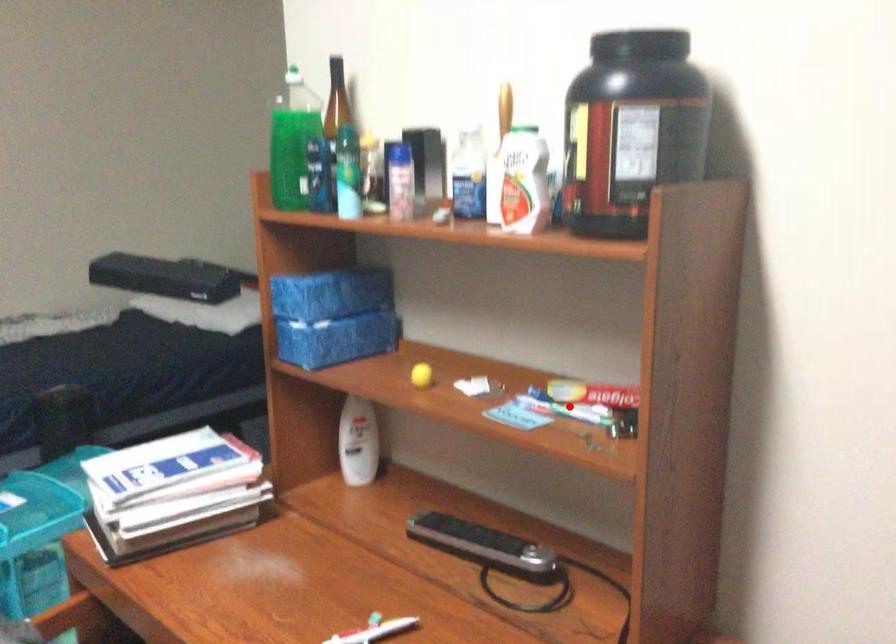
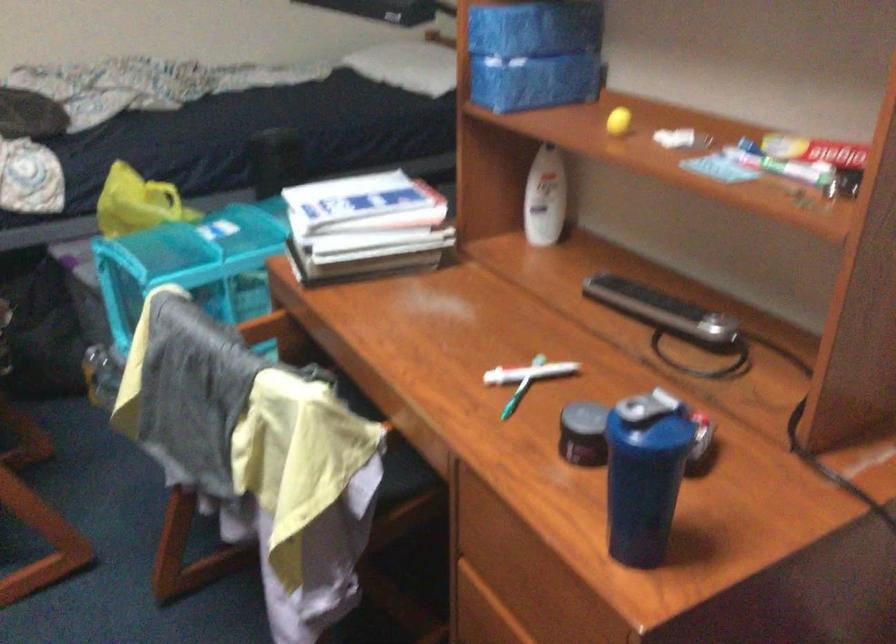
Locate, in the second image, the point that corresponds to the highlighted location in the first image.

(780, 164)